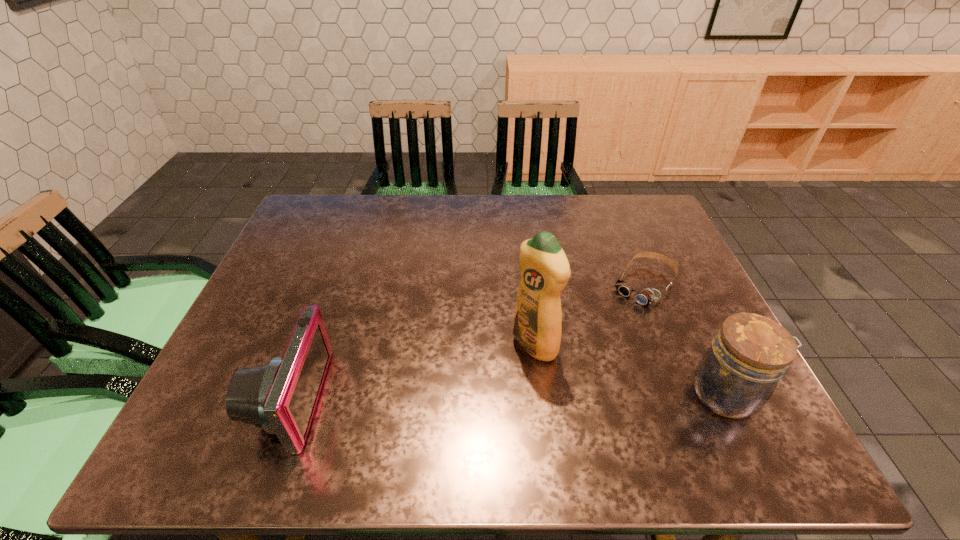
Identify the location of free space between the second tallest object and the tallest object. (632, 369).

Identify the location of empty space between the farthest object and the second object from left to right. This screenshot has height=540, width=960. (589, 315).

Identify the location of free space between the tallest object and the jar. The height and width of the screenshot is (540, 960). (632, 369).

Locate an element on the screen. free space between the tallest object and the shortest object is located at coordinates (589, 315).

Where is `unoccupied area between the camera and the shortest object`? unoccupied area between the camera and the shortest object is located at coordinates (468, 342).

Locate an element on the screen. empty space between the third object from right to left and the jar is located at coordinates (632, 369).

The image size is (960, 540). I want to click on free spot between the second tallest object and the second object from left to right, so click(x=632, y=369).

Image resolution: width=960 pixels, height=540 pixels. I want to click on free space between the third shortest object and the second shortest object, so click(x=511, y=396).

At what (x,y) coordinates should I click in order to perform the action: click on object that is the third closest to the jar. Please return your answer as a coordinate pair (x, y). The height and width of the screenshot is (540, 960). Looking at the image, I should click on (280, 396).

Locate which object is the third closest to the goggles. Please provide its 2D coordinates. Your answer should be formatted as a tuple, i.e. [(x, y)], where the tuple contains the x and y coordinates of a point satisfying the conditions above.

[(280, 396)]